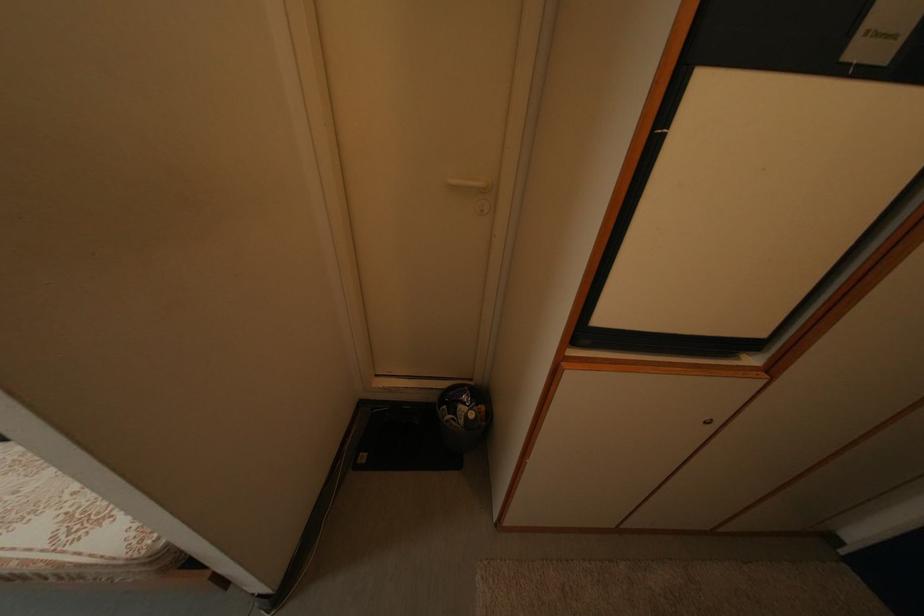
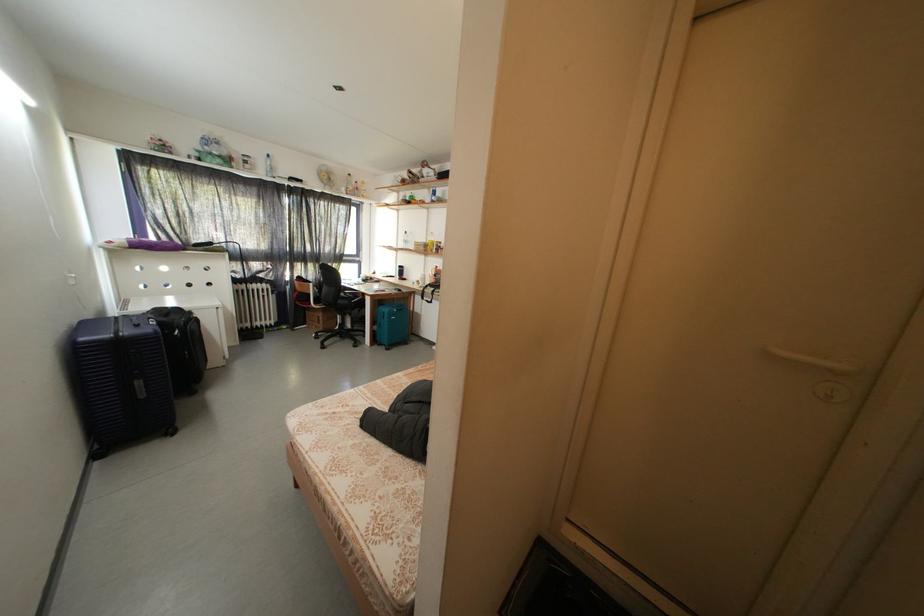
Question: How did the camera likely rotate?

Choices:
 (A) Left
 (B) Right
 (C) Up
 (D) Down

Answer: (A)